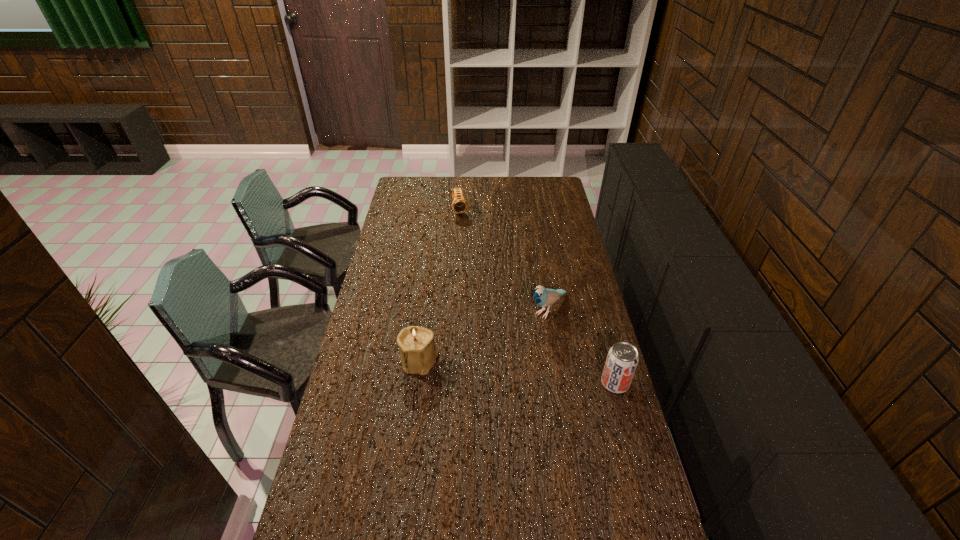
Locate an element on the screen. The height and width of the screenshot is (540, 960). free region located on the face of the shortest object is located at coordinates click(x=471, y=252).

The image size is (960, 540). In order to click on vacant space located 0.060m at the face of the bird in this screenshot , I will do `click(527, 332)`.

The image size is (960, 540). I want to click on vacant space located at the face of the bird, so click(520, 339).

Identify the location of free spot located 0.190m at the face of the bird. (505, 353).

This screenshot has width=960, height=540. Find the location of `soda can that is positioned at the right edge`. soda can that is positioned at the right edge is located at coordinates (622, 359).

Where is `bird that is at the right edge`? bird that is at the right edge is located at coordinates [543, 297].

You are a GUI agent. You are given a task and a screenshot of the screen. Output one action in this format:
    pyautogui.click(x=<x>, y=<y>)
    Task: Click on the vacant space at the far edge of the desktop
    The image size is (960, 540).
    Given the screenshot: What is the action you would take?
    pyautogui.click(x=460, y=180)

In the image, there is a desktop. Find the location of `blank space at the left edge`. blank space at the left edge is located at coordinates (409, 217).

In the image, there is a desktop. Where is `free region at the right edge`? The image size is (960, 540). free region at the right edge is located at coordinates (561, 338).

Where is `vacant space at the far left corner of the desktop`? The width and height of the screenshot is (960, 540). vacant space at the far left corner of the desktop is located at coordinates (404, 198).